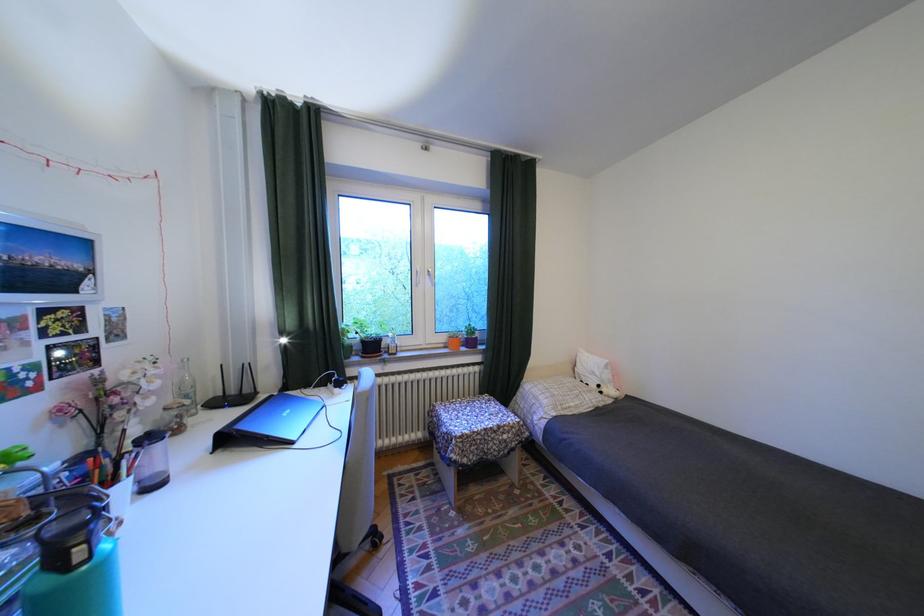
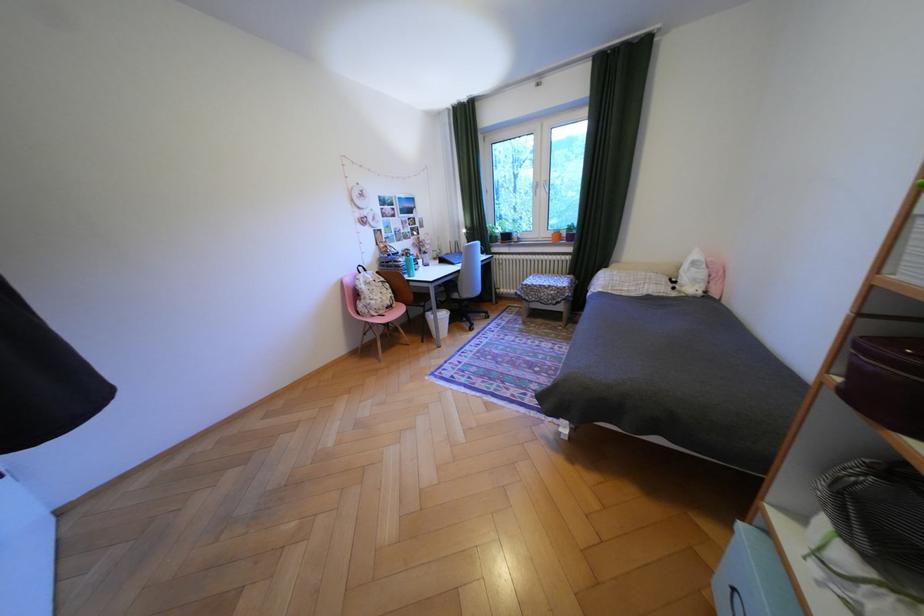
The point at (611, 386) is marked in the first image. Where is the corresponding point in the second image?

(687, 282)